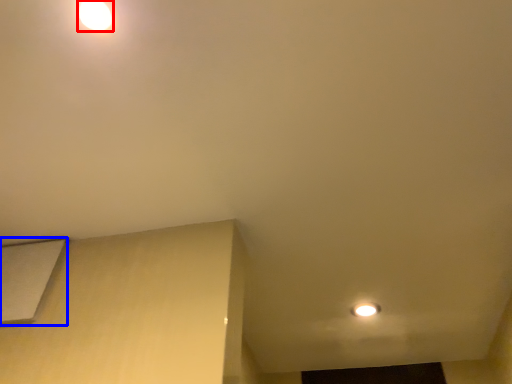
Question: Which point is further to the camera, lamp (highlighted by a red box) or lift (highlighted by a blue box)?

Choices:
 (A) lamp
 (B) lift

Answer: (B)